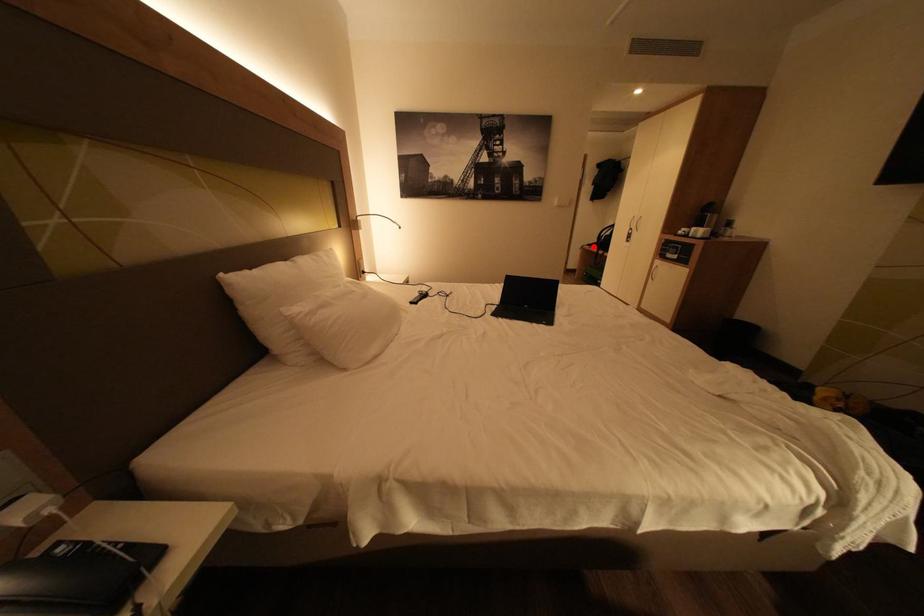
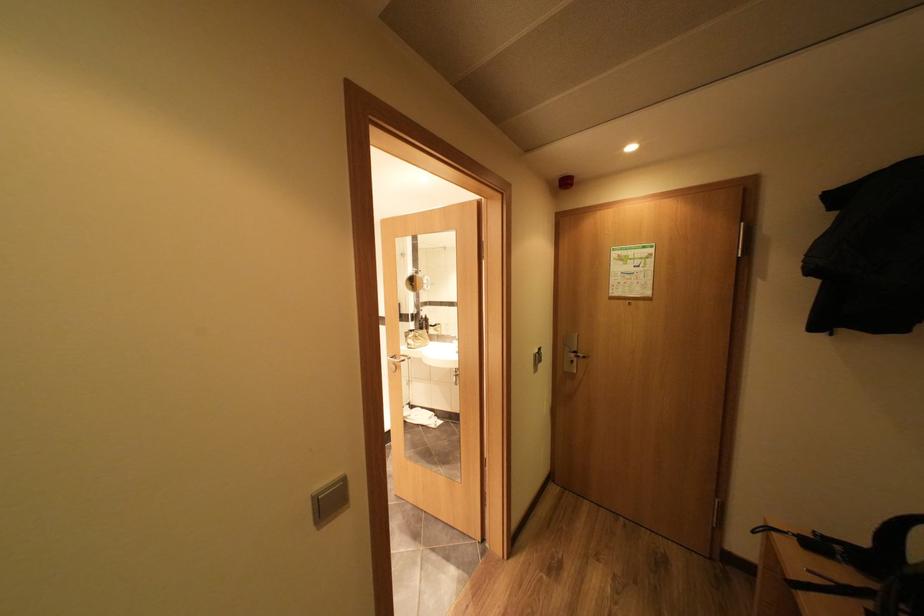
Question: A red point is marked in image1. In image2, is the corresponding 3D point closer to the camera or farther? Reply with the corresponding letter.

Choices:
 (A) The corresponding 3D point is closer.
 (B) The corresponding 3D point is farther.

Answer: (B)